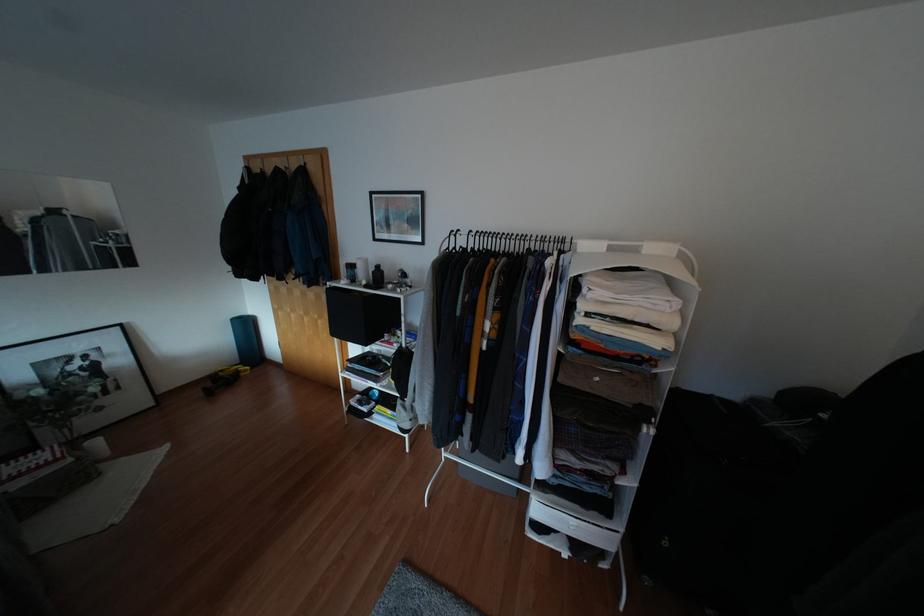
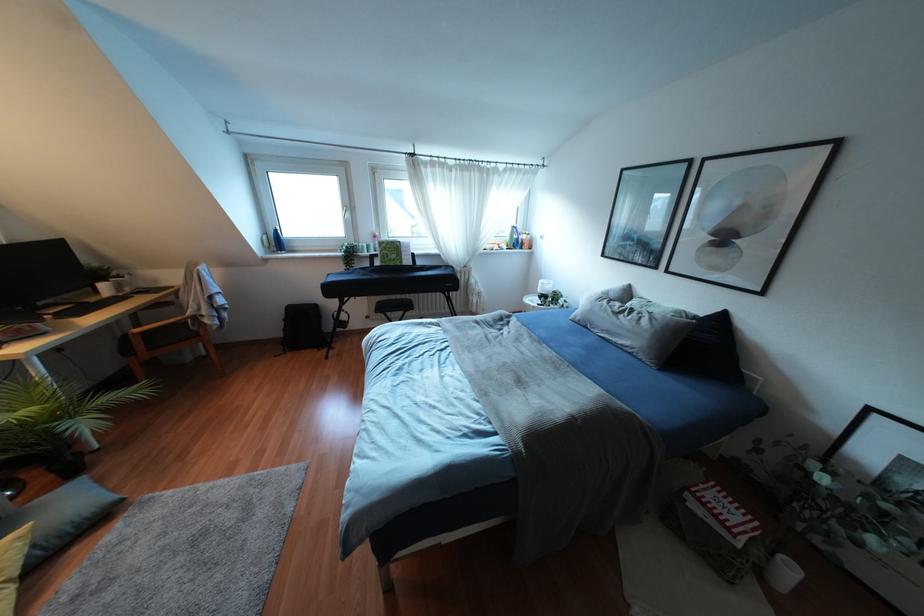
The point at (94, 442) is marked in the first image. Where is the corresponding point in the second image?

(791, 570)